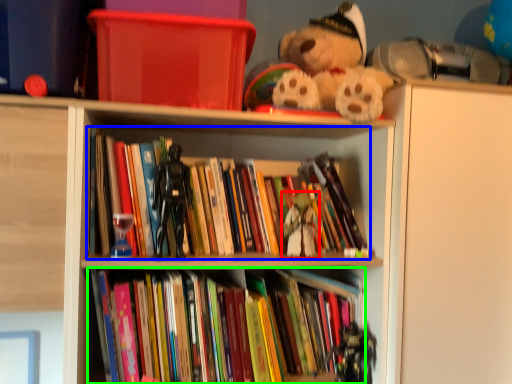
Question: Considering the real-world distances, which object is farthest from miniature (highlighted by a red box)? book (highlighted by a blue box) or book (highlighted by a green box)?

Choices:
 (A) book
 (B) book

Answer: (B)